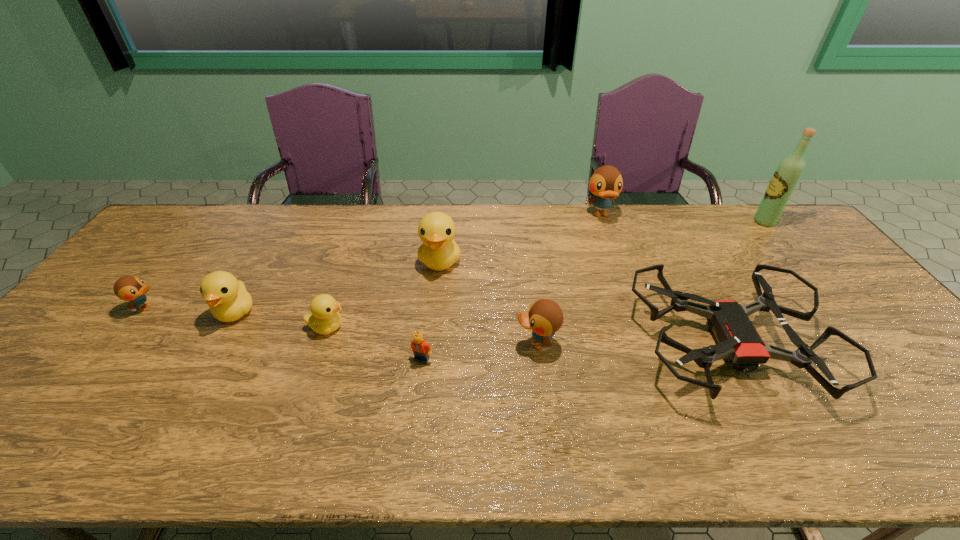
You are a GUI agent. You are given a task and a screenshot of the screen. Output one action in this format:
    pyautogui.click(x=<x>, y=<y>)
    Task: Click on the free region located 0.150m on the face of the biggest yellow duck
    The width and height of the screenshot is (960, 540).
    Given the screenshot: What is the action you would take?
    pyautogui.click(x=434, y=317)

The width and height of the screenshot is (960, 540). I want to click on vacant space located on the face of the second smallest yellow duck, so click(212, 353).

Find the location of a particular element. free space located 0.380m on the front-facing side of the second biggest blue duck is located at coordinates (368, 343).

Where is `free spot located 0.290m on the front-facing side of the second biggest blue duck`? free spot located 0.290m on the front-facing side of the second biggest blue duck is located at coordinates (403, 343).

You are a GUI agent. You are given a task and a screenshot of the screen. Output one action in this format:
    pyautogui.click(x=<x>, y=<y>)
    Task: Click on the free space located on the front-facing side of the second biggest blue duck
    
    Given the screenshot: What is the action you would take?
    pyautogui.click(x=391, y=343)

The width and height of the screenshot is (960, 540). I want to click on vacant space located on the front-facing side of the smallest blue duck, so click(247, 307).

Locate an element on the screen. vacant space located 0.050m on the face of the third object from left to right is located at coordinates point(366,327).

This screenshot has height=540, width=960. I want to click on blank area located 0.260m with the camera facing forward on the drone, so click(532, 344).

In order to click on vacant space positioned with the camera facing forward on the drone in this screenshot , I will do `click(505, 344)`.

I want to click on blank space located with the camera facing forward on the drone, so click(536, 344).